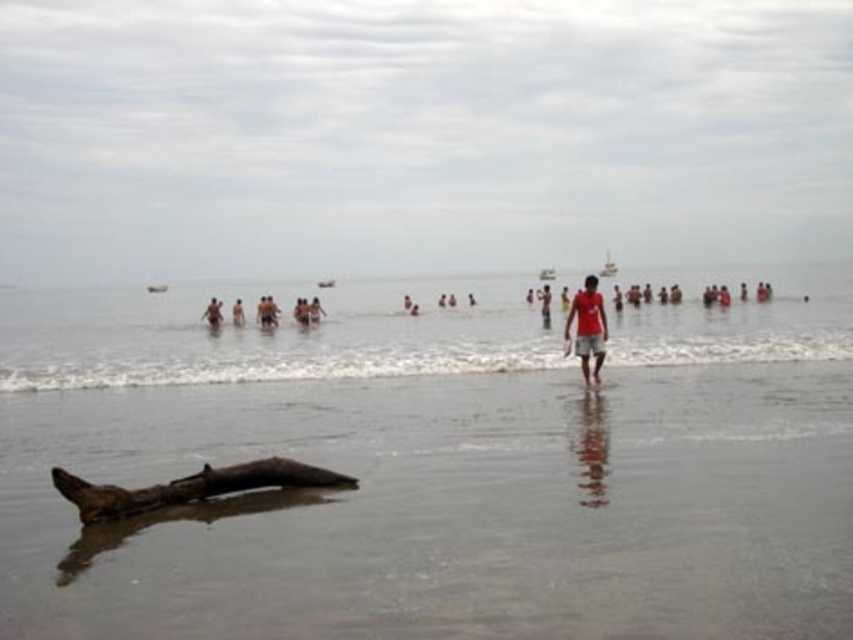
Question: Estimate the real-world distances between objects in this image. Which object is closer to the brown wood log at lower center?

Choices:
 (A) red t-shirt at center
 (B) smooth skin person at center

Answer: (A)

Question: Is brown wood at center closer to the viewer compared to brown wood log at lower center?

Choices:
 (A) no
 (B) yes

Answer: (B)

Question: Which object appears closest to the camera in this image?

Choices:
 (A) matte red t-shirt at center
 (B) smooth skin person at center
 (C) brown wood at center

Answer: (C)

Question: Considering the real-world distances, which object is closest to the smooth skin person at center?

Choices:
 (A) red t-shirt at center
 (B) matte red t-shirt at center
 (C) brown wood log at lower center

Answer: (A)

Question: Is brown wood at center positioned in front of brown wood log at lower center?

Choices:
 (A) no
 (B) yes

Answer: (B)

Question: Does matte red t-shirt at center appear on the right side of red t-shirt at center?

Choices:
 (A) no
 (B) yes

Answer: (A)